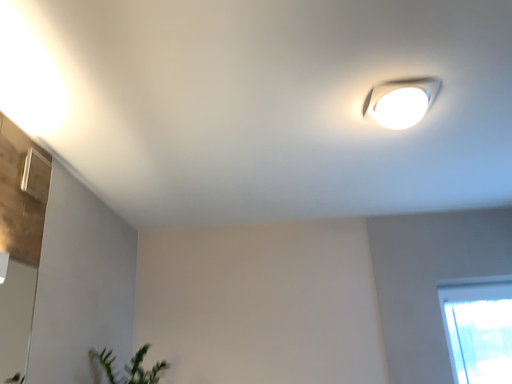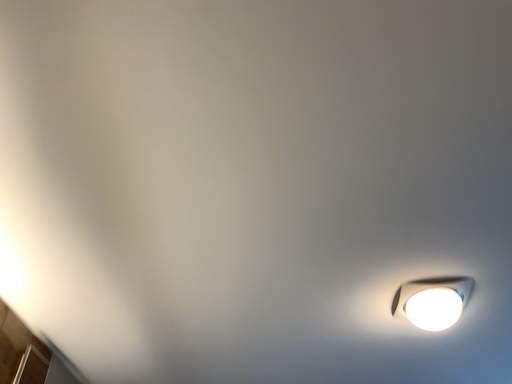
Question: How did the camera likely rotate when shooting the video?

Choices:
 (A) rotated downward
 (B) rotated upward

Answer: (B)